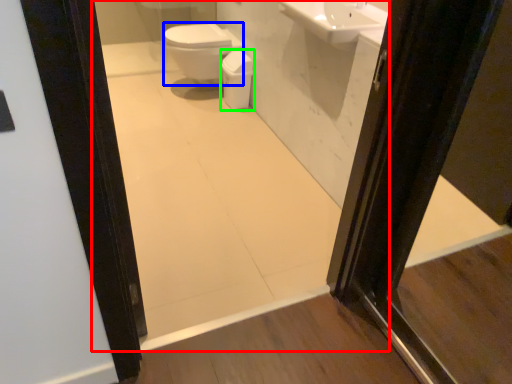
Question: Based on their relative distances, which object is nearer to mirror (highlighted by a red box)? Choose from bidet (highlighted by a blue box) and toilet bowl (highlighted by a green box).

Choices:
 (A) bidet
 (B) toilet bowl

Answer: (B)